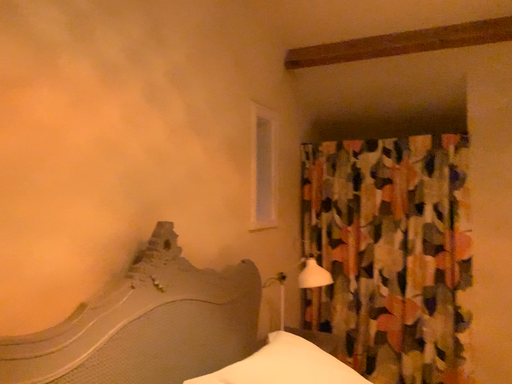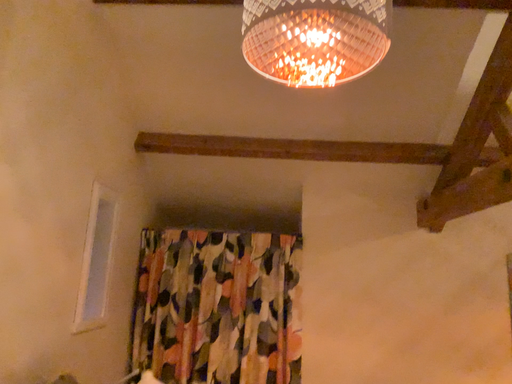
Question: How did the camera likely rotate when shooting the video?

Choices:
 (A) rotated right
 (B) rotated left

Answer: (A)